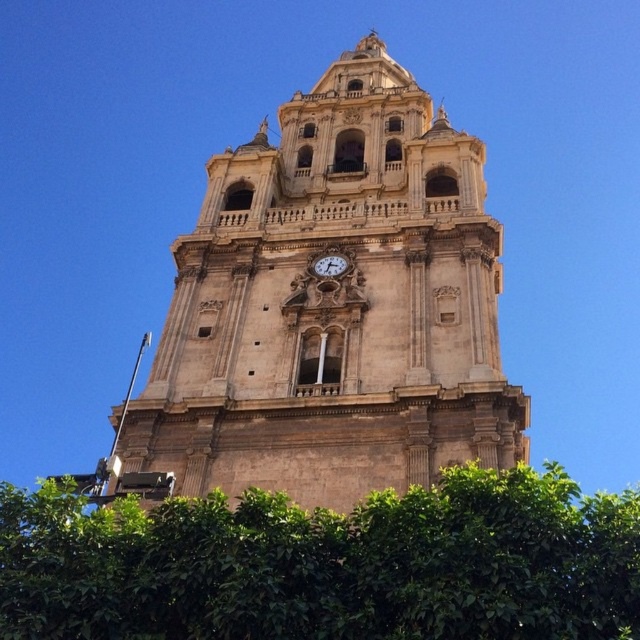
Is point (410, 99) positioned in front of point (316, 257)?

No, (410, 99) is further to viewer.

Is point (499, 440) positioned after point (337, 259)?

That is False.

Who is more forward, (429, 164) or (328, 252)?

Point (328, 252) is more forward.

Where is `beige stone clock tower at center`? beige stone clock tower at center is located at coordinates (333, 305).

Between green leafy tree at center and white marble clock at center, which one has more height?

green leafy tree at center

The width and height of the screenshot is (640, 640). What do you see at coordinates (326, 563) in the screenshot?
I see `green leafy tree at center` at bounding box center [326, 563].

Find the location of a particular element. green leafy tree at center is located at coordinates (326, 563).

Which is more to the left, beige stone clock tower at center or green leafy tree at center?

From the viewer's perspective, beige stone clock tower at center appears more on the left side.

Who is positioned more to the right, beige stone clock tower at center or green leafy tree at center?

From the viewer's perspective, green leafy tree at center appears more on the right side.

Is point (448, 412) farther from viewer compared to point (541, 524)?

Yes, it is.

Image resolution: width=640 pixels, height=640 pixels. I want to click on beige stone clock tower at center, so click(x=333, y=305).